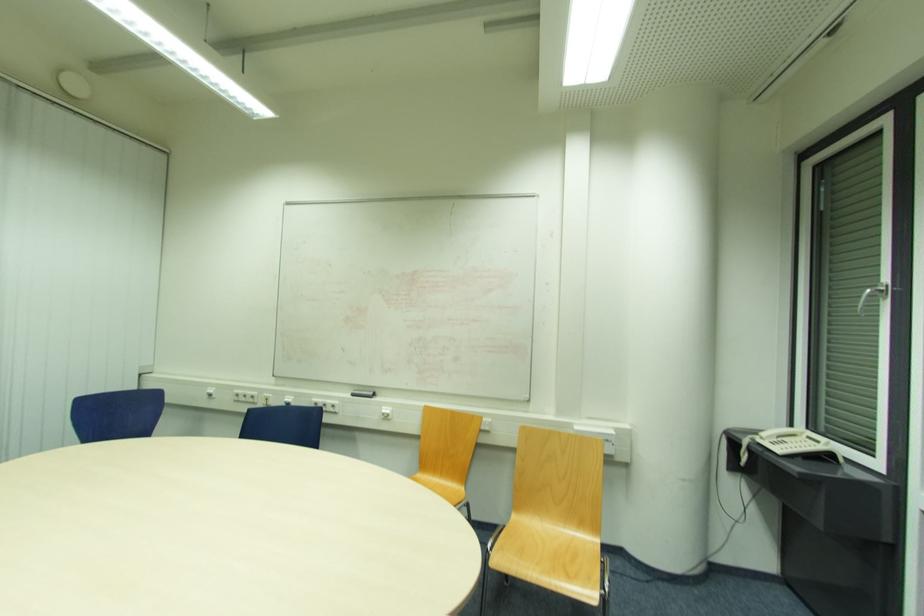
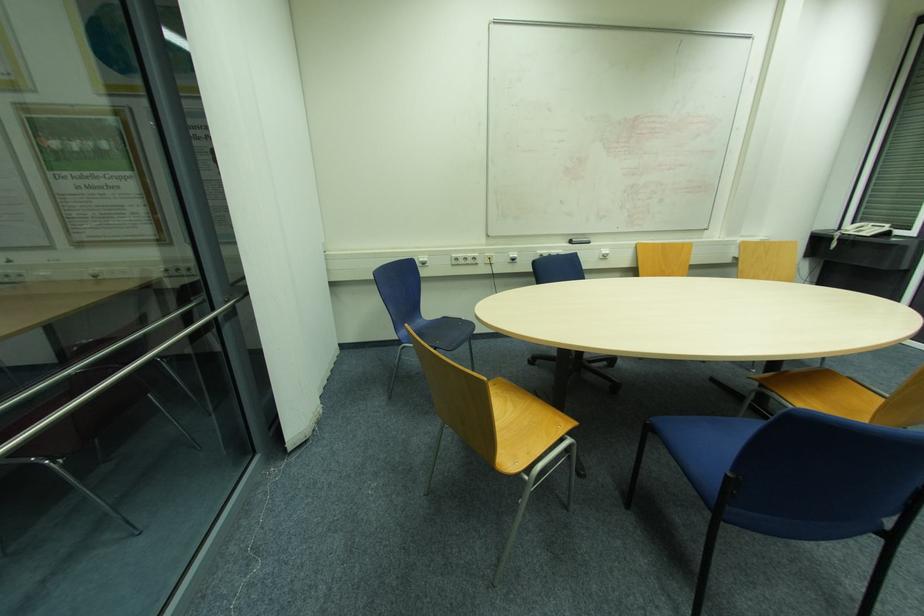
The point at (x=247, y=397) is marked in the first image. Where is the corresponding point in the second image?

(467, 259)